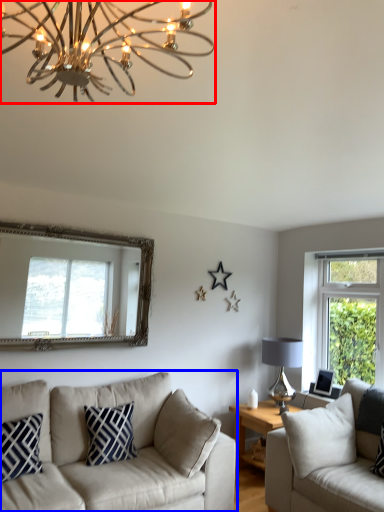
Question: Which object appears farthest to the camera in this image, lamp (highlighted by a red box) or studio couch (highlighted by a blue box)?

Choices:
 (A) lamp
 (B) studio couch

Answer: (B)